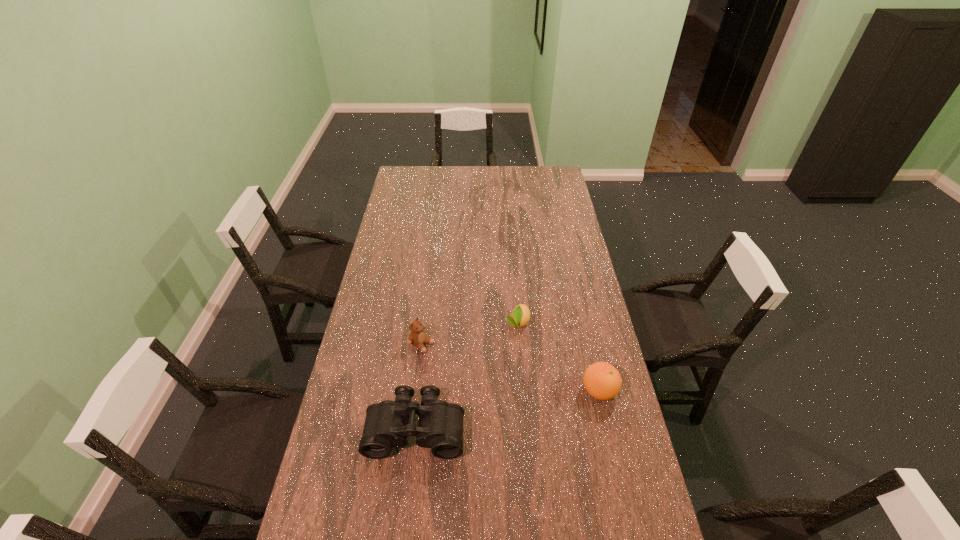
Where is `free space on the desktop that is between the binoculars and the orange and is positioned on the front-facing side of the teddy bear`? The width and height of the screenshot is (960, 540). free space on the desktop that is between the binoculars and the orange and is positioned on the front-facing side of the teddy bear is located at coordinates (538, 403).

Locate an element on the screen. The image size is (960, 540). vacant space on the desktop that is between the binoculars and the orange and is positioned with leaves positioned above the second object from right to left is located at coordinates (496, 412).